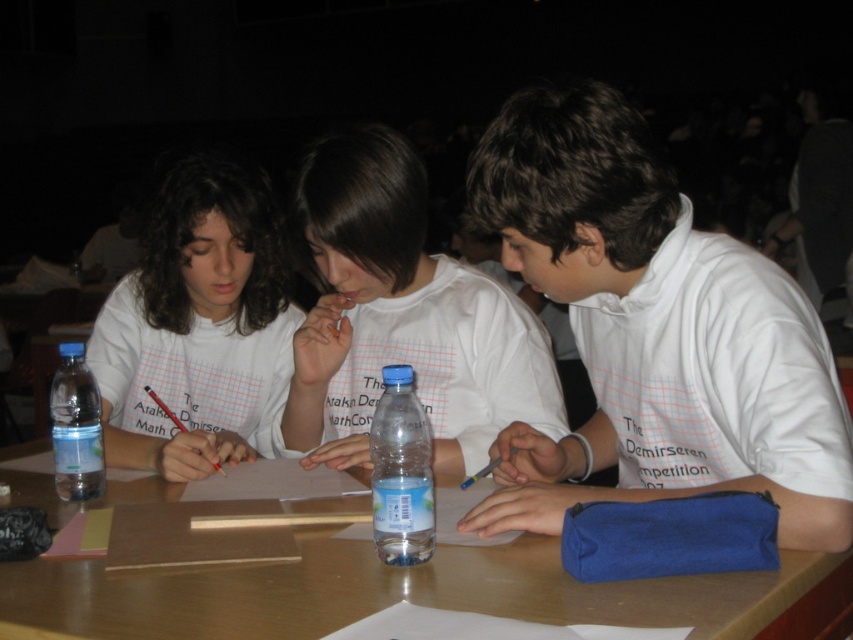
Question: Where is white cotton shirt at center located in relation to matte white shirt at left in the image?

Choices:
 (A) left
 (B) right

Answer: (B)

Question: Which point is closer to the camera?

Choices:
 (A) (167, 611)
 (B) (785, 547)
 (C) (358, 280)
 (D) (418, 550)

Answer: (A)

Question: Can you confirm if matte white shirt at left is positioned to the left of translucent plastic bottle at center?

Choices:
 (A) no
 (B) yes

Answer: (B)

Question: Which is nearer to the white matte shirt at center?

Choices:
 (A) clear plastic bottle at left
 (B) translucent plastic bottle at center
 (C) white cotton shirt at center
 (D) wooden table at center

Answer: (C)

Question: Does matte white shirt at left have a lesser width compared to translucent plastic bottle at center?

Choices:
 (A) yes
 (B) no

Answer: (B)

Question: Based on their relative distances, which object is farther from the white cotton shirt at center?

Choices:
 (A) wooden table at center
 (B) clear plastic bottle at left

Answer: (B)